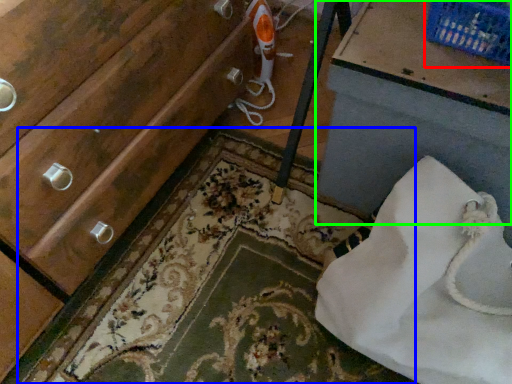
Question: Which object is positioned farthest from basket (highlighted by a red box)? Select from bath mat (highlighted by a blue box) and vanity (highlighted by a green box).

Choices:
 (A) bath mat
 (B) vanity

Answer: (A)